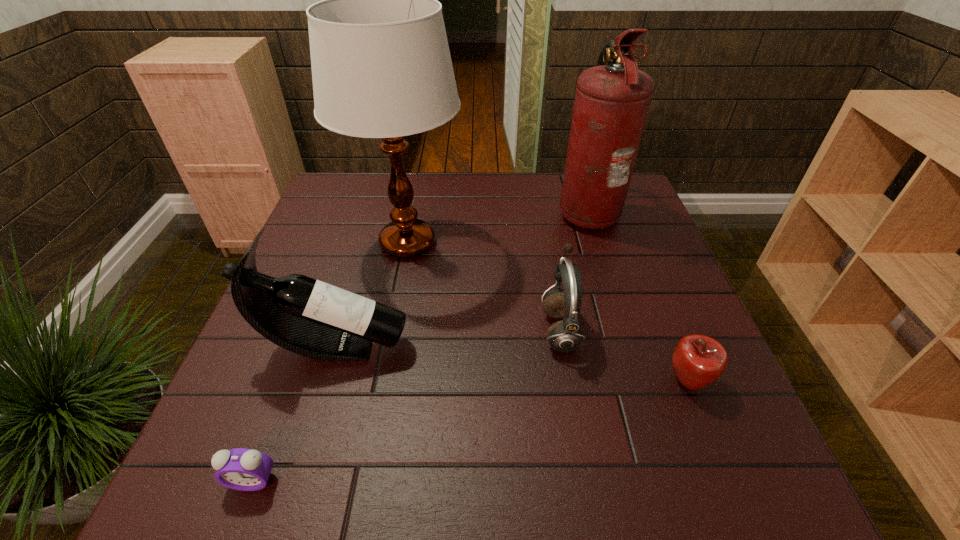
Find the location of `object situated at the near edge`. object situated at the near edge is located at coordinates (242, 469).

Image resolution: width=960 pixels, height=540 pixels. Find the location of `table lamp that is at the left edge`. table lamp that is at the left edge is located at coordinates (381, 66).

Image resolution: width=960 pixels, height=540 pixels. In order to click on wine bottle that is at the left edge in this screenshot , I will do `click(306, 316)`.

The image size is (960, 540). Find the location of `alarm clock that is at the left edge`. alarm clock that is at the left edge is located at coordinates (242, 469).

This screenshot has height=540, width=960. Find the location of `fire extinguisher located at the right edge`. fire extinguisher located at the right edge is located at coordinates (612, 100).

At what (x,y) coordinates should I click in order to perform the action: click on apple that is at the right edge. Please return your answer as a coordinate pair (x, y). This screenshot has height=540, width=960. Looking at the image, I should click on (698, 360).

This screenshot has height=540, width=960. What are the coordinates of `object situated at the far left corner` in the screenshot? It's located at (381, 66).

The width and height of the screenshot is (960, 540). I want to click on object located in the near left corner section of the desktop, so click(242, 469).

Locate an element on the screen. object present at the far right corner is located at coordinates (612, 100).

The image size is (960, 540). I want to click on free space at the far edge of the desktop, so click(455, 204).